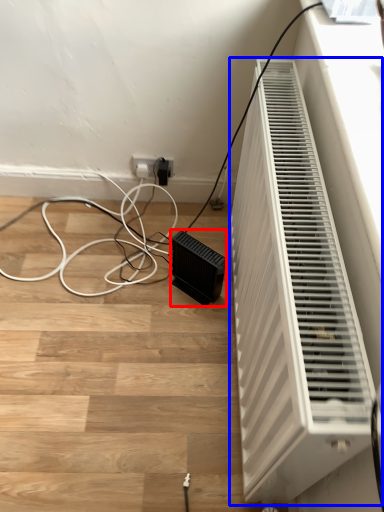
Question: Which of the following is the farthest to the observer, speaker (highlighted by a red box) or home appliance (highlighted by a blue box)?

Choices:
 (A) speaker
 (B) home appliance

Answer: (A)